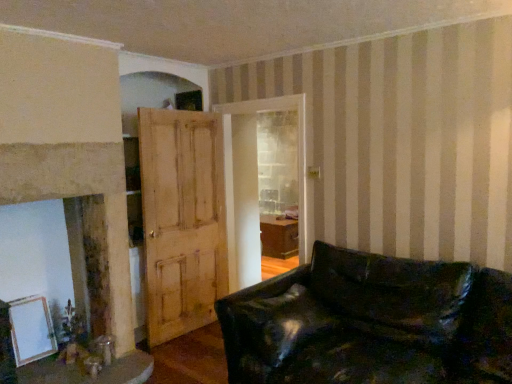
Question: Considering the relative positions of light brown wooden door at center and smooth beige fireplace at left in the image provided, is light brown wooden door at center behind smooth beige fireplace at left?

Choices:
 (A) no
 (B) yes

Answer: (B)

Question: Is light brown wooden door at center next to smooth beige fireplace at left and touching it?

Choices:
 (A) yes
 (B) no

Answer: (B)

Question: Is light brown wooden door at center outside of smooth beige fireplace at left?

Choices:
 (A) no
 (B) yes

Answer: (B)

Question: From a real-world perspective, is light brown wooden door at center over smooth beige fireplace at left?

Choices:
 (A) yes
 (B) no

Answer: (B)

Question: Does light brown wooden door at center have a larger size compared to smooth beige fireplace at left?

Choices:
 (A) yes
 (B) no

Answer: (B)

Question: From the image's perspective, is light brown wooden door at center above smooth beige fireplace at left?

Choices:
 (A) yes
 (B) no

Answer: (B)

Question: Does smooth beige fireplace at left appear on the left side of white matte picture frame at lower left?

Choices:
 (A) yes
 (B) no

Answer: (B)

Question: Would you say white matte picture frame at lower left is part of smooth beige fireplace at left's contents?

Choices:
 (A) yes
 (B) no

Answer: (A)

Question: From the image's perspective, is smooth beige fireplace at left beneath white matte picture frame at lower left?

Choices:
 (A) yes
 (B) no

Answer: (B)

Question: Would you say smooth beige fireplace at left is outside white matte picture frame at lower left?

Choices:
 (A) no
 (B) yes

Answer: (B)

Question: Does smooth beige fireplace at left have a lesser width compared to white matte picture frame at lower left?

Choices:
 (A) no
 (B) yes

Answer: (A)

Question: Does smooth beige fireplace at left come behind white matte picture frame at lower left?

Choices:
 (A) yes
 (B) no

Answer: (B)

Question: Would you say wooden table at lower left is a long distance from white matte picture frame at lower left?

Choices:
 (A) no
 (B) yes

Answer: (A)